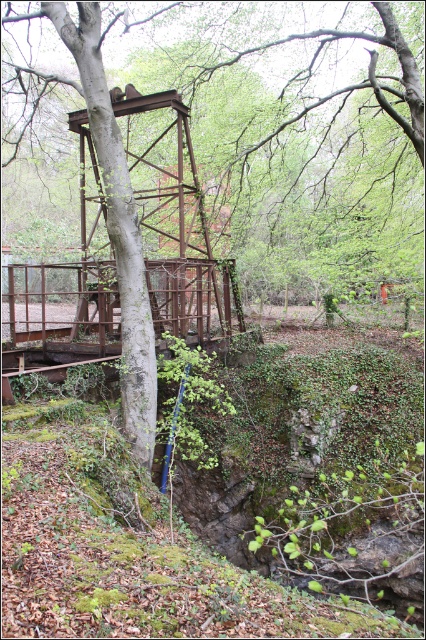
Is green mossy hillside at lower left to the left of rusty metal bridge at center from the viewer's perspective?

In fact, green mossy hillside at lower left is to the right of rusty metal bridge at center.

Is green mossy hillside at lower left above rusty metal bridge at center?

Actually, green mossy hillside at lower left is below rusty metal bridge at center.

Is point (198, 524) positioned before point (117, 328)?

Yes, it is in front of point (117, 328).

I want to click on green mossy hillside at lower left, so click(134, 538).